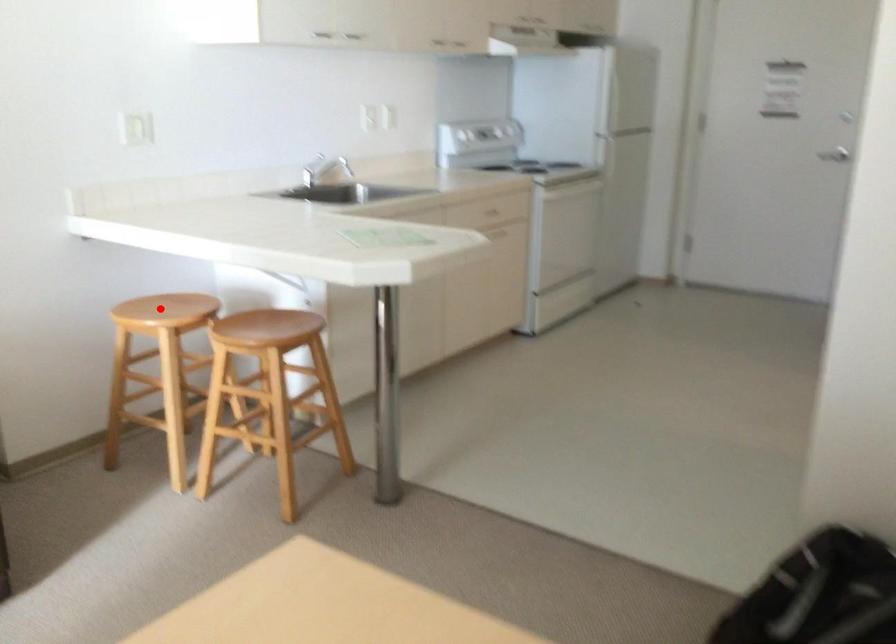
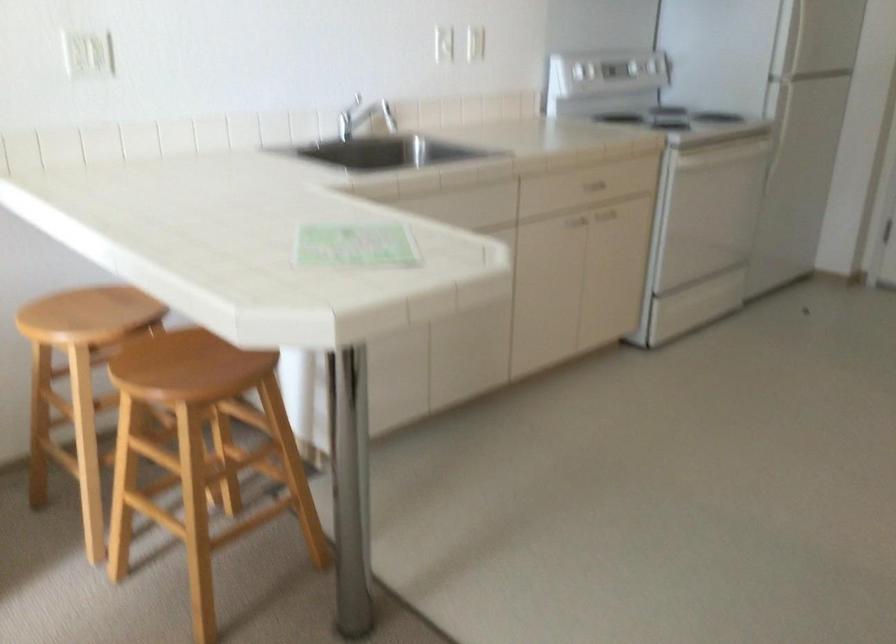
Question: I am providing you with two images of the same scene from different viewpoints. In image1, a red point is highlighted. Considering the same 3D point in image2, which of the following is correct?

Choices:
 (A) It is closer
 (B) It is farther

Answer: (A)